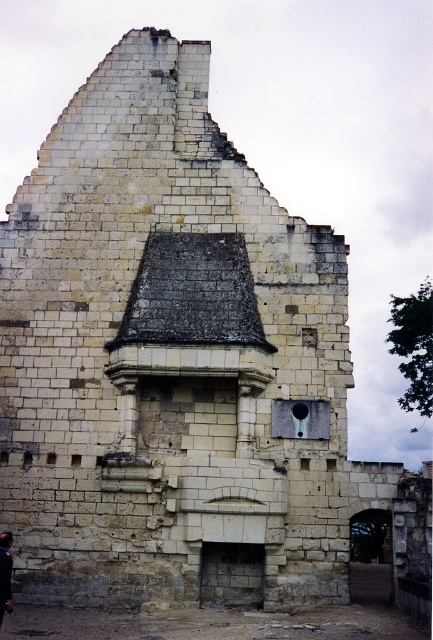
Is smooth brown leather bag at lower left thinner than black hair at upper center?

Incorrect, smooth brown leather bag at lower left's width is not less than black hair at upper center's.

Is smooth brown leather bag at lower left positioned at the back of black hair at upper center?

That is False.

Find the location of a particular element. Image resolution: width=433 pixels, height=640 pixels. smooth brown leather bag at lower left is located at coordinates (5, 573).